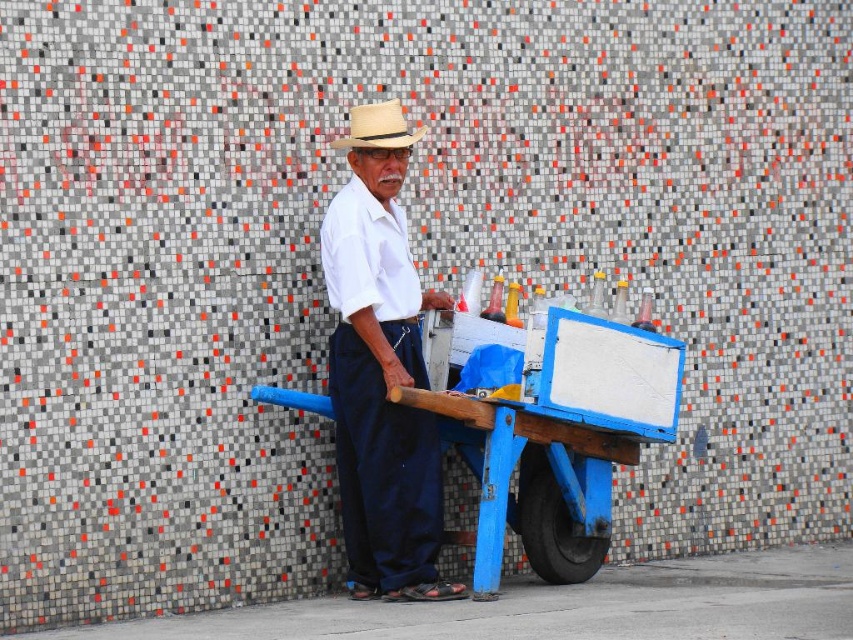
You are a customer looking at the blue painted wood cart at center and the white cotton shirt at center. Which item is positioned lower from the ground?

The blue painted wood cart at center is located below the white cotton shirt at center, so it is positioned lower from the ground.

You are a customer at a street market and see the blue painted wood cart at center and the white cotton shirt at center. Which item is taller?

The white cotton shirt at center is taller than the blue painted wood cart at center.

You are standing in front of the elderly man in the image. There is a point at coordinates (381, 371). Which object from the scene does this point belong to?

The point at coordinates (381, 371) is on the white cotton shirt at center.